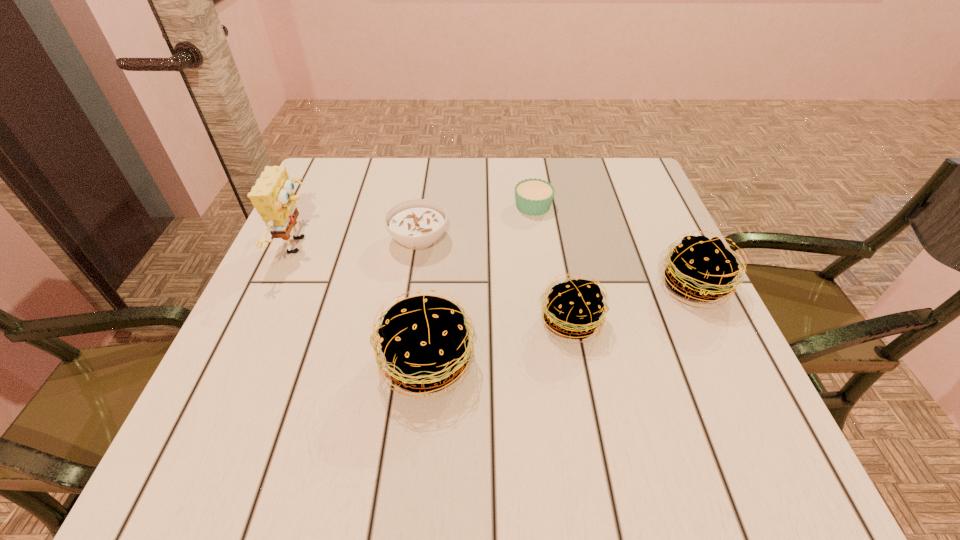
In the current image, all pattys are evenly spaced. To maintain this equal spacing, where should an additional patty be placed on the left? Please point out a free spot. Please provide its 2D coordinates. Your answer should be formatted as a tuple, i.e. [(x, y)], where the tuple contains the x and y coordinates of a point satisfying the conditions above.

[(256, 411)]